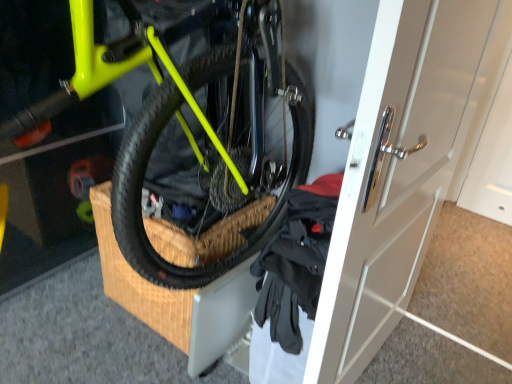
Question: Considering the positions of neon yellow matte bicycle at center and white glossy door at center in the image, is neon yellow matte bicycle at center bigger or smaller than white glossy door at center?

Choices:
 (A) big
 (B) small

Answer: (A)

Question: Considering the positions of point (10, 130) and point (327, 379), is point (10, 130) closer or farther from the camera than point (327, 379)?

Choices:
 (A) closer
 (B) farther

Answer: (A)

Question: Based on their relative distances, which object is farther from the black fabric gloves at lower right?

Choices:
 (A) white glossy door at center
 (B) neon yellow matte bicycle at center

Answer: (B)

Question: Which object is the farthest from the white glossy door at center?

Choices:
 (A) neon yellow matte bicycle at center
 (B) black fabric gloves at lower right

Answer: (A)